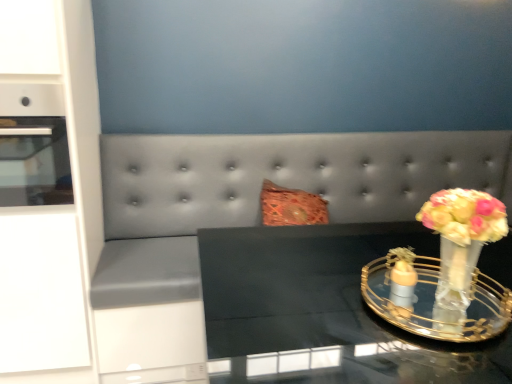
The height and width of the screenshot is (384, 512). Identify the location of free point behind matte orange glass candle holder at right, the 1th candle holder positioned from the left. (372, 278).